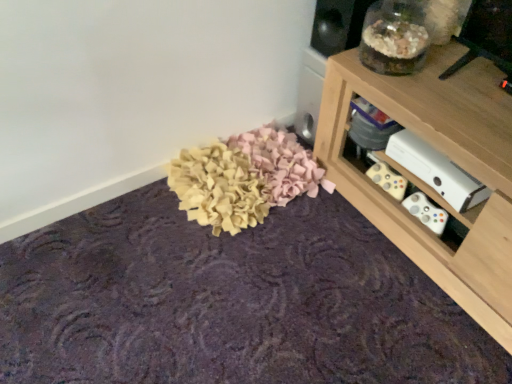
Question: From the image's perspective, is white matte xbox at lower right above or below wooden shelf at upper right?

Choices:
 (A) below
 (B) above

Answer: (B)

Question: Considering the positions of point (411, 152) and point (454, 115), is point (411, 152) closer or farther from the camera than point (454, 115)?

Choices:
 (A) closer
 (B) farther

Answer: (B)

Question: Which of these objects is positioned farthest from the wooden shelf at upper right?

Choices:
 (A) felt-like fabric at center
 (B) white matte xbox at lower right

Answer: (A)

Question: Considering the real-world distances, which object is closest to the wooden shelf at upper right?

Choices:
 (A) felt-like fabric at center
 (B) white matte xbox at lower right

Answer: (B)